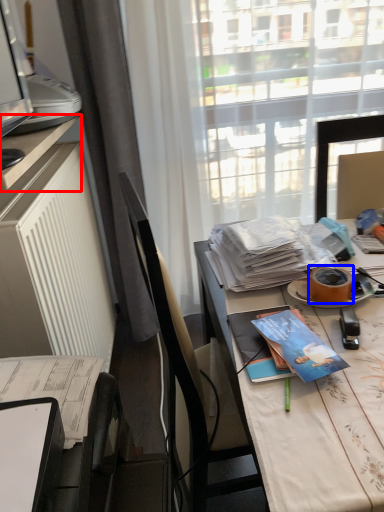
Question: Which object appears farthest to the camera in this image, desk (highlighted by a red box) or adhesive tape (highlighted by a blue box)?

Choices:
 (A) desk
 (B) adhesive tape

Answer: (B)